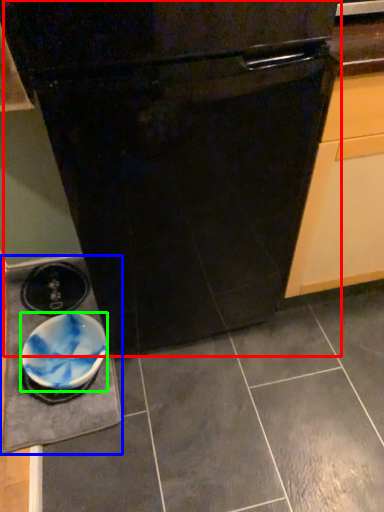
Question: Based on their relative distances, which object is farther from oven (highlighted by a red box)? Choose from slate (highlighted by a blue box) and bowl (highlighted by a green box).

Choices:
 (A) slate
 (B) bowl

Answer: (A)